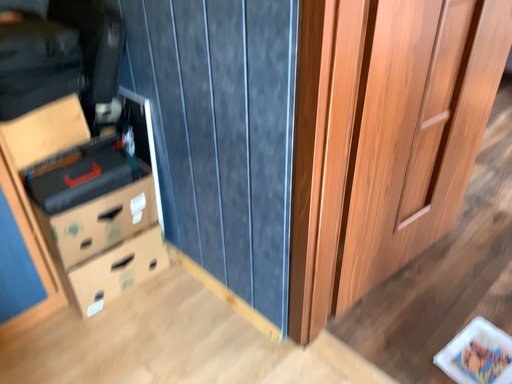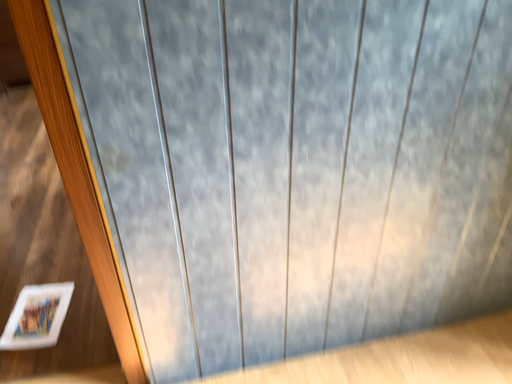
Question: Which way did the camera rotate in the video?

Choices:
 (A) rotated left
 (B) rotated right

Answer: (B)